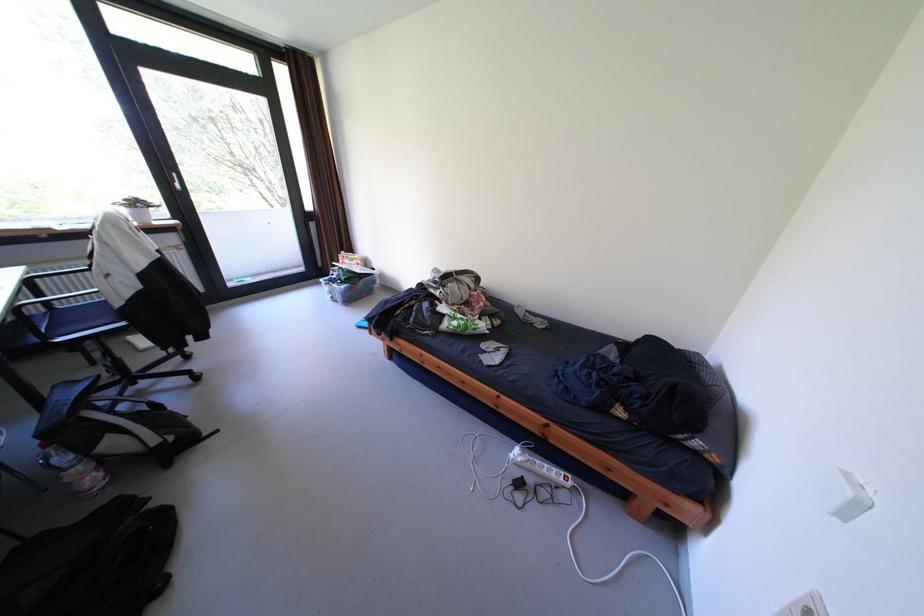
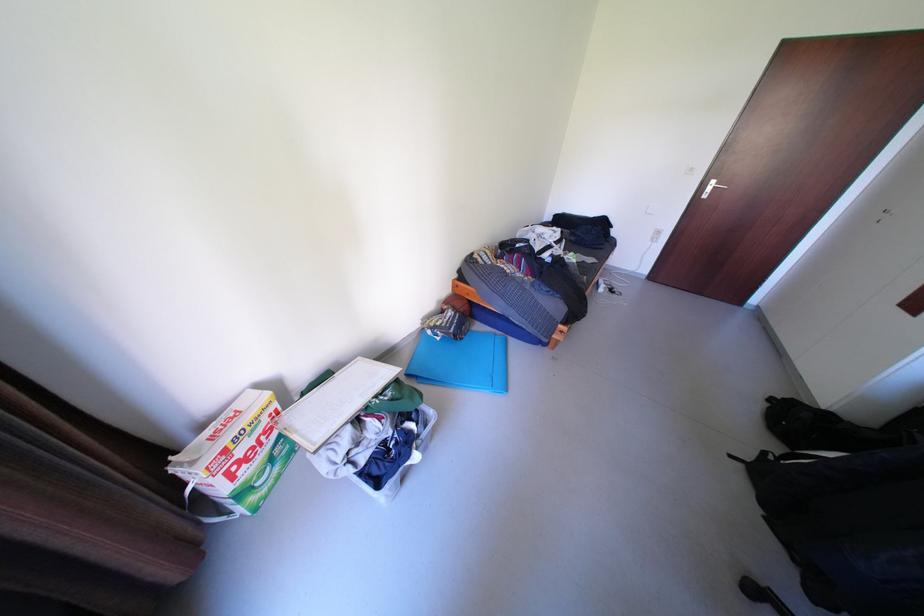
Locate, in the second image, the point that corresponds to (217,434) in the first image.

(752, 466)